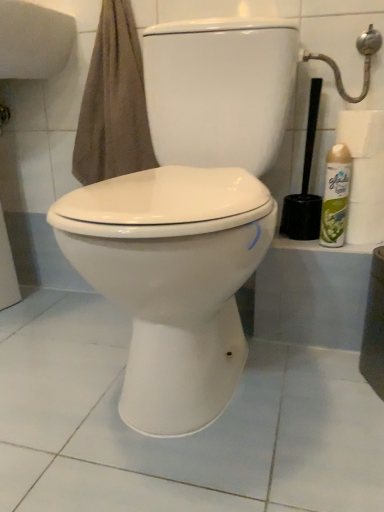
Describe the element at coordinates (188, 217) in the screenshot. I see `white glossy toilet at center` at that location.

What is the approximate height of metallic silver showerhead at upper right?

metallic silver showerhead at upper right is 17.06 centimeters in height.

The width and height of the screenshot is (384, 512). What do you see at coordinates (365, 223) in the screenshot? I see `white glossy toilet paper at right, the first toilet paper from the bottom` at bounding box center [365, 223].

The height and width of the screenshot is (512, 384). Describe the element at coordinates (335, 196) in the screenshot. I see `green spray can at right` at that location.

Measure the distance between green spray can at right and camera.

green spray can at right is 93.83 centimeters from camera.

From the picture: In order to face black plastic toilet brush at right, should I rotate leftwards or rightwards?

You should rotate right by 14.671 degrees.

You are a GUI agent. You are given a task and a screenshot of the screen. Output one action in this format:
    pyautogui.click(x=<x>, y=<y>)
    Task: Click on the white glossy toilet at center
    Image resolution: width=384 pixels, height=512 pixels.
    Given the screenshot: What is the action you would take?
    pyautogui.click(x=188, y=217)

Could green spray can at right be considered to be inside white glossy toilet at center?

That's incorrect, green spray can at right is not inside white glossy toilet at center.

Is white glossy toilet at center oriented towards green spray can at right?

No, white glossy toilet at center does not turn towards green spray can at right.

Does point (217, 202) appear closer or farther from the camera than point (330, 217)?

Point (217, 202).

In the scene shown: Which object is positioned more to the right, white glossy toilet at center or green spray can at right?

green spray can at right is more to the right.

Considering the positions of point (365, 39) and point (349, 122), is point (365, 39) closer or farther from the camera than point (349, 122)?

Point (365, 39).

Does metallic silver showerhead at upper right have a lesser height compared to white matte toilet paper at right, which is the first toilet paper from top to bottom?

Incorrect, the height of metallic silver showerhead at upper right does not fall short of that of white matte toilet paper at right, which is the first toilet paper from top to bottom.

Which object is wider, metallic silver showerhead at upper right or white matte toilet paper at right, which is the first toilet paper from top to bottom?

Wider between the two is white matte toilet paper at right, which is the first toilet paper from top to bottom.

From a real-world perspective, who is located lower, metallic silver showerhead at upper right or white matte toilet paper at right, which is the first toilet paper from top to bottom?

In real-world perspective, white matte toilet paper at right, which is the first toilet paper from top to bottom, is lower.

Is white glossy toilet paper at right, the first toilet paper from the bottom, outside of white matte toilet paper at right, which is the first toilet paper from top to bottom?

white glossy toilet paper at right, the first toilet paper from the bottom, is positioned outside white matte toilet paper at right, which is the first toilet paper from top to bottom.

Can you tell me how much white glossy toilet paper at right, the first toilet paper from the bottom, and white matte toilet paper at right, which is the first toilet paper from top to bottom, differ in facing direction?

white glossy toilet paper at right, the first toilet paper from the bottom, and white matte toilet paper at right, which is the first toilet paper from top to bottom, are facing 0 degrees away from each other.

From the image's perspective, is white glossy toilet paper at right, the first toilet paper from the bottom, on top of white matte toilet paper at right, the second toilet paper ordered from the bottom?

No, from the image's perspective, white glossy toilet paper at right, the first toilet paper from the bottom, is not above white matte toilet paper at right, the second toilet paper ordered from the bottom.

Is white matte toilet paper at right, which is the first toilet paper from top to bottom, oriented towards black plastic toilet brush at right?

No.

Based on their sizes in the image, would you say white matte toilet paper at right, the second toilet paper ordered from the bottom, is bigger or smaller than black plastic toilet brush at right?

Answer: Considering their sizes, white matte toilet paper at right, the second toilet paper ordered from the bottom, takes up less space than black plastic toilet brush at right.

Locate an element on the screen. The image size is (384, 512). toilet paper positioned vertically above the black plastic toilet brush at right (from a real-world perspective) is located at coordinates pos(361,132).

Which of these two, green spray can at right or white glossy toilet at center, stands shorter?

green spray can at right is shorter.

Between point (348, 181) and point (156, 262), which one is positioned behind?

The point (348, 181) is farther.

Is green spray can at right at the right side of white glossy toilet at center?

Yes.

Does white glossy toilet at center have a larger size compared to white matte toilet paper at right, which is the first toilet paper from top to bottom?

Correct, white glossy toilet at center is larger in size than white matte toilet paper at right, which is the first toilet paper from top to bottom.

Which point is more distant from viewer, (232, 372) or (379, 132)?

The point (379, 132) is behind.

In the scene shown: How much distance is there between white glossy toilet at center and white matte toilet paper at right, which is the first toilet paper from top to bottom?

white glossy toilet at center and white matte toilet paper at right, which is the first toilet paper from top to bottom, are 16.81 inches apart.

From the picture: Considering the sizes of objects white glossy toilet at center and white matte toilet paper at right, which is the first toilet paper from top to bottom, in the image provided, who is taller, white glossy toilet at center or white matte toilet paper at right, which is the first toilet paper from top to bottom,?

white glossy toilet at center is taller.

Is black plastic toilet brush at right oriented away from white glossy toilet paper at right, the first toilet paper from the bottom?

No.

From a real-world perspective, between black plastic toilet brush at right and white glossy toilet paper at right, arranged as the second toilet paper when viewed from the top, who is vertically lower?

white glossy toilet paper at right, arranged as the second toilet paper when viewed from the top, is physically lower.

Would you consider black plastic toilet brush at right to be distant from white glossy toilet paper at right, arranged as the second toilet paper when viewed from the top?

They are positioned close to each other.

Looking at this image, how much distance is there between black plastic toilet brush at right and white glossy toilet paper at right, the first toilet paper from the bottom?

A distance of 5.95 inches exists between black plastic toilet brush at right and white glossy toilet paper at right, the first toilet paper from the bottom.

The width and height of the screenshot is (384, 512). What are the coordinates of `toilet that is above the green spray can at right (from a real-world perspective)` in the screenshot? It's located at (188, 217).

From the image's perspective, which toilet paper is the 1st one below the metallic silver showerhead at upper right? Please provide its 2D coordinates.

[(361, 132)]

Estimate the real-world distances between objects in this image. Which object is closer to white glossy toilet paper at right, the first toilet paper from the bottom, white matte toilet paper at right, the second toilet paper ordered from the bottom, or black plastic toilet brush at right?

black plastic toilet brush at right is positioned closer to the anchor white glossy toilet paper at right, the first toilet paper from the bottom.

From the image, which object appears to be farther from metallic silver showerhead at upper right, white glossy toilet at center or black plastic toilet brush at right?

The object further to metallic silver showerhead at upper right is white glossy toilet at center.

From the image, which object appears to be farther from green spray can at right, white glossy toilet at center or white matte toilet paper at right, which is the first toilet paper from top to bottom?

white glossy toilet at center lies further to green spray can at right than the other object.

Based on their spatial positions, is black plastic toilet brush at right or white glossy toilet at center further from green spray can at right?

white glossy toilet at center.

Which object lies nearer to the anchor point metallic silver showerhead at upper right, black plastic toilet brush at right or white glossy toilet paper at right, the first toilet paper from the bottom?

black plastic toilet brush at right lies closer to metallic silver showerhead at upper right than the other object.

Looking at the image, which one is located closer to black plastic toilet brush at right, white glossy toilet at center or metallic silver showerhead at upper right?

metallic silver showerhead at upper right is closer to black plastic toilet brush at right.

Consider the image. When comparing their distances from white glossy toilet paper at right, the first toilet paper from the bottom, does metallic silver showerhead at upper right or white glossy toilet at center seem closer?

metallic silver showerhead at upper right lies closer to white glossy toilet paper at right, the first toilet paper from the bottom, than the other object.

Considering their positions, is white matte toilet paper at right, the second toilet paper ordered from the bottom, positioned further to black plastic toilet brush at right than white glossy toilet paper at right, arranged as the second toilet paper when viewed from the top?

white matte toilet paper at right, the second toilet paper ordered from the bottom.

You are a GUI agent. You are given a task and a screenshot of the screen. Output one action in this format:
    pyautogui.click(x=<x>, y=<y>)
    Task: Click on the cleaning product between white matte toilet paper at right, which is the first toilet paper from top to bottom, and white glossy toilet paper at right, arranged as the second toilet paper when viewed from the top, in the up-down direction
    This screenshot has width=384, height=512.
    Given the screenshot: What is the action you would take?
    pyautogui.click(x=335, y=196)

Image resolution: width=384 pixels, height=512 pixels. What are the coordinates of `brush between metallic silver showerhead at upper right and green spray can at right in the up-down direction` in the screenshot? It's located at (305, 184).

Where is `toilet paper positioned between white glossy toilet at center and green spray can at right from near to far`? toilet paper positioned between white glossy toilet at center and green spray can at right from near to far is located at coordinates (361, 132).

Where is `toilet paper between metallic silver showerhead at upper right and green spray can at right in the vertical direction`? The image size is (384, 512). toilet paper between metallic silver showerhead at upper right and green spray can at right in the vertical direction is located at coordinates (361, 132).